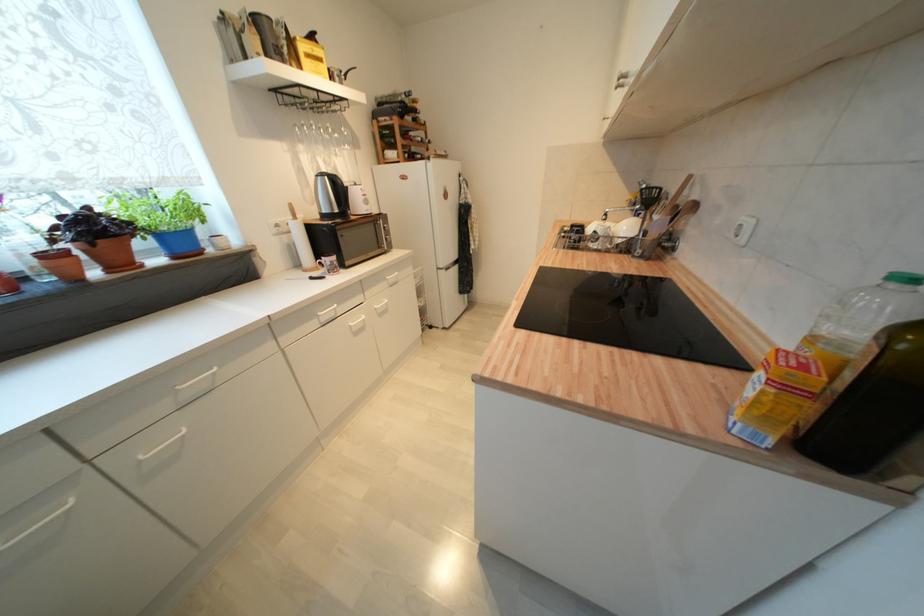
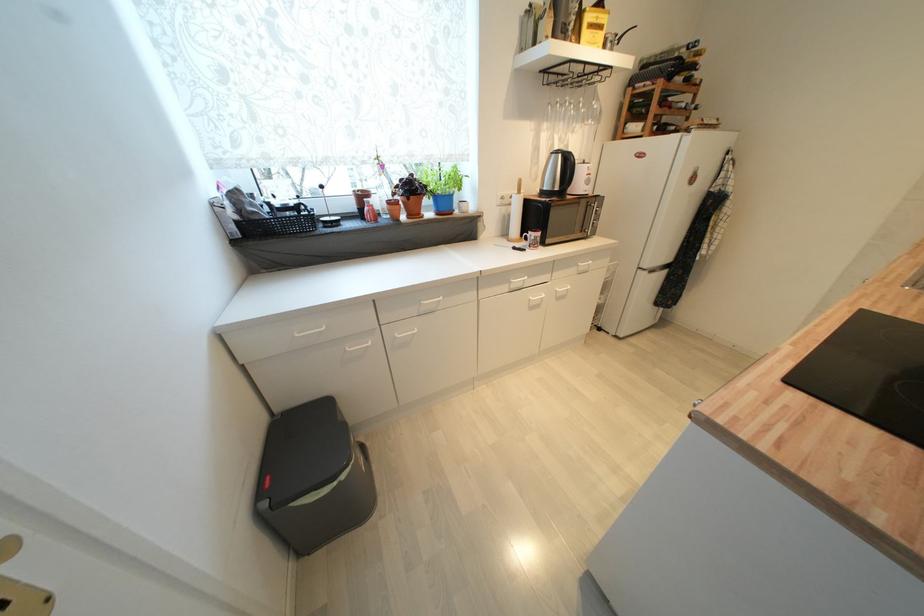
Locate, in the second image, the point that corresponds to the point at 342,213 in the first image.

(562, 191)